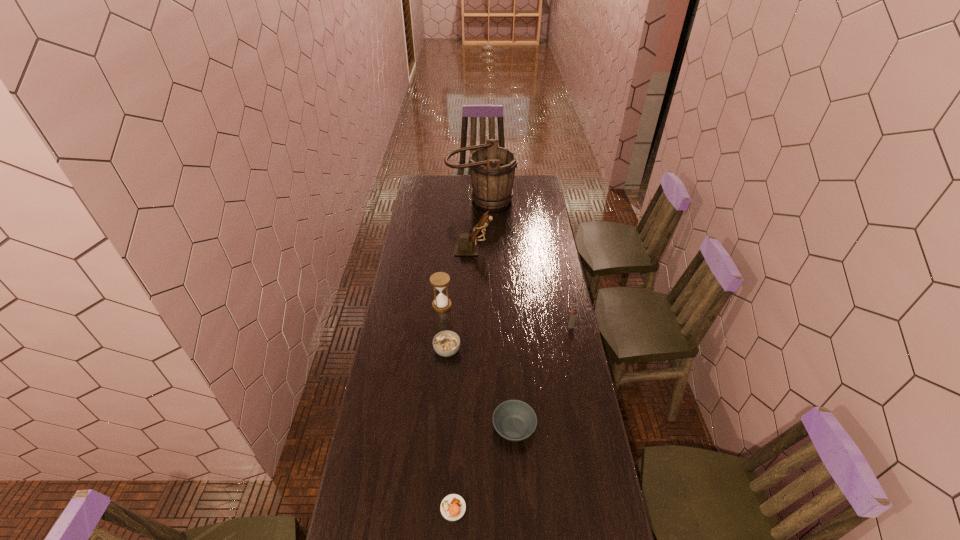
This screenshot has height=540, width=960. What are the coordinates of `bucket` in the screenshot? It's located at (492, 168).

Identify the location of the farthest object. (492, 168).

I want to click on figurine, so click(466, 246).

Locate an element on the screen. the second tallest object is located at coordinates (466, 246).

I want to click on the fifth nearest object, so click(440, 280).

You are a GUI agent. You are given a task and a screenshot of the screen. Output one action in this format:
    pyautogui.click(x=<x>, y=<y>)
    Task: Click on the fifth shortest object
    
    Given the screenshot: What is the action you would take?
    pyautogui.click(x=440, y=280)

At what (x,y) coordinates should I click in order to perform the action: click on the rightmost object. Please return your answer as a coordinate pair (x, y). This screenshot has width=960, height=540. Looking at the image, I should click on (573, 315).

In order to click on the fourth nearest object in this screenshot , I will do `click(573, 315)`.

The height and width of the screenshot is (540, 960). Find the location of `the farther soup bowl`. the farther soup bowl is located at coordinates coord(446,343).

At what (x,y) coordinates should I click in order to perform the action: click on the left soup bowl. Please return your answer as a coordinate pair (x, y). Looking at the image, I should click on (446, 343).